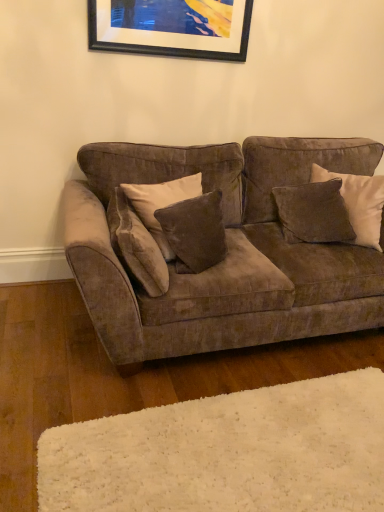
Locate an element on the screen. The width and height of the screenshot is (384, 512). white shag rug at lower center is located at coordinates (227, 452).

This screenshot has height=512, width=384. What do you see at coordinates (172, 28) in the screenshot?
I see `black matte picture frame at upper center` at bounding box center [172, 28].

Where is `velvet brown pillow at center, the first pillow in the left-to-right sequence`? velvet brown pillow at center, the first pillow in the left-to-right sequence is located at coordinates (136, 245).

In the scene shown: What is the approximate height of velvet brown pillow at center, the second pillow viewed from the left?

16.51 inches.

Where is `white shag rug at lower center`? white shag rug at lower center is located at coordinates (227, 452).

From the image's perspective, which one is positioned higher, black matte picture frame at upper center or velvet brown pillow at center, the first pillow in the left-to-right sequence?

black matte picture frame at upper center appears higher in the image.

Is black matte picture frame at upper center completely or partially outside of velvet brown pillow at center, the first pillow in the left-to-right sequence?

black matte picture frame at upper center is positioned outside velvet brown pillow at center, the first pillow in the left-to-right sequence.

Locate an element on the screen. Image resolution: width=384 pixels, height=512 pixels. pillow that is the 2nd one when counting forward from the black matte picture frame at upper center is located at coordinates (136, 245).

Is point (247, 39) closer to viewer compared to point (119, 230)?

No.

Can velvet brown pillow at right, which is the 3th pillow in left-to-right order, be found inside velvet brown pillow at center, the second pillow viewed from the left?

That's incorrect, velvet brown pillow at right, which is the 3th pillow in left-to-right order, is not inside velvet brown pillow at center, the second pillow viewed from the left.

Considering the sizes of velvet brown pillow at center, the second pillow viewed from the left, and velvet brown pillow at right, the second pillow viewed from the right, in the image, is velvet brown pillow at center, the second pillow viewed from the left, bigger or smaller than velvet brown pillow at right, the second pillow viewed from the right,?

Considering their sizes, velvet brown pillow at center, the second pillow viewed from the left, takes up more space than velvet brown pillow at right, the second pillow viewed from the right.

Does velvet brown pillow at center, the third pillow viewed from the right, have a greater height compared to velvet brown pillow at right, which is the 3th pillow in left-to-right order?

Indeed, velvet brown pillow at center, the third pillow viewed from the right, has a greater height compared to velvet brown pillow at right, which is the 3th pillow in left-to-right order.

From the image's perspective, is velvet brown pillow at center, the third pillow viewed from the right, under velvet brown pillow at right, which is the 3th pillow in left-to-right order?

Yes, from the image's perspective, velvet brown pillow at center, the third pillow viewed from the right, is below velvet brown pillow at right, which is the 3th pillow in left-to-right order.

Is velvet brown pillow at center, the 4th pillow in the right-to-left sequence, in contact with velvet brown pillow at right, which is the 3th pillow in left-to-right order?

No.

Is velvet brown pillow at center, the first pillow in the left-to-right sequence, to the left or to the right of velvet brown pillow at right, the second pillow viewed from the right, in the image?

velvet brown pillow at center, the first pillow in the left-to-right sequence, is to the left of velvet brown pillow at right, the second pillow viewed from the right.

Between velvet brown pillow at center, the first pillow in the left-to-right sequence, and velvet brown pillow at right, which is the 3th pillow in left-to-right order, which one has smaller width?

velvet brown pillow at center, the first pillow in the left-to-right sequence.

From a real-world perspective, is white shag rug at lower center positioned under velvet brown pillow at center, the 4th pillow in the right-to-left sequence, based on gravity?

Yes, from a real-world perspective, white shag rug at lower center is below velvet brown pillow at center, the 4th pillow in the right-to-left sequence.

Which pillow is the 2nd one when counting from the left side of the white shag rug at lower center? Please provide its 2D coordinates.

[(136, 245)]

Between white shag rug at lower center and velvet brown pillow at center, the first pillow in the left-to-right sequence, which one has larger size?

velvet brown pillow at center, the first pillow in the left-to-right sequence, is bigger.

Is velvet brown pillow at center, the second pillow viewed from the left, positioned before velvet brown couch at center?

No, the depth of velvet brown pillow at center, the second pillow viewed from the left, is greater than that of velvet brown couch at center.

Could you tell me if velvet brown pillow at center, the second pillow viewed from the left, is turned towards velvet brown couch at center?

Yes, velvet brown pillow at center, the second pillow viewed from the left, is turned towards velvet brown couch at center.

Choose the correct answer: Is velvet brown pillow at center, the third pillow viewed from the right, inside velvet brown couch at center or outside it?

velvet brown pillow at center, the third pillow viewed from the right, is spatially positioned inside velvet brown couch at center.

Is white shag rug at lower center oriented towards velvet brown pillow at right, which is the 3th pillow in left-to-right order?

No, white shag rug at lower center is not oriented towards velvet brown pillow at right, which is the 3th pillow in left-to-right order.

Is white shag rug at lower center not within velvet brown pillow at right, which is the 3th pillow in left-to-right order?

Yes, white shag rug at lower center is not within velvet brown pillow at right, which is the 3th pillow in left-to-right order.

Is white shag rug at lower center positioned before velvet brown pillow at right, which is the 3th pillow in left-to-right order?

Yes, white shag rug at lower center is closer to the camera.

Is white shag rug at lower center bigger than velvet brown pillow at right, which is the 3th pillow in left-to-right order?

Actually, white shag rug at lower center might be smaller than velvet brown pillow at right, which is the 3th pillow in left-to-right order.

From the image's perspective, which one is positioned higher, velvet brown couch at center or velvet brown pillow at center, the second pillow viewed from the left?

From the image's view, velvet brown pillow at center, the second pillow viewed from the left, is above.

In the scene shown: Between velvet brown couch at center and velvet brown pillow at center, the third pillow viewed from the right, which one has larger width?

velvet brown couch at center is wider.

Is velvet brown couch at center oriented towards velvet brown pillow at center, the second pillow viewed from the left?

Yes.

Is velvet brown couch at center positioned beyond the bounds of velvet brown pillow at center, the third pillow viewed from the right?

velvet brown couch at center is positioned outside velvet brown pillow at center, the third pillow viewed from the right.

Identify the location of picture frame behind the velvet brown pillow at center, the first pillow in the left-to-right sequence. This screenshot has height=512, width=384. (172, 28).

The width and height of the screenshot is (384, 512). Find the location of `the 1st pillow positioned below the velvet brown pillow at center, the second pillow viewed from the left (from a real-world perspective)`. the 1st pillow positioned below the velvet brown pillow at center, the second pillow viewed from the left (from a real-world perspective) is located at coordinates (313, 213).

Which object lies nearer to the anchor point black matte picture frame at upper center, velvet brown pillow at center, the 4th pillow in the right-to-left sequence, or white shag rug at lower center?

The object closer to black matte picture frame at upper center is velvet brown pillow at center, the 4th pillow in the right-to-left sequence.

Based on their spatial positions, is velvet brown pillow at right, which is the 3th pillow in left-to-right order, or velvet brown pillow at center, the first pillow in the left-to-right sequence, further from white shag rug at lower center?

Based on the image, velvet brown pillow at right, which is the 3th pillow in left-to-right order, appears to be further to white shag rug at lower center.

In the scene shown: Which object lies nearer to the anchor point velvet brown pillow at right, which is the 3th pillow in left-to-right order, velvet brown pillow at center, the second pillow viewed from the left, or white shag rug at lower center?

velvet brown pillow at center, the second pillow viewed from the left, is positioned closer to the anchor velvet brown pillow at right, which is the 3th pillow in left-to-right order.

Which object lies further to the anchor point velvet brown pillow at upper right, the 4th pillow from the left, velvet brown pillow at center, the 4th pillow in the right-to-left sequence, or white shag rug at lower center?

white shag rug at lower center is further to velvet brown pillow at upper right, the 4th pillow from the left.

From the image, which object appears to be farther from white shag rug at lower center, velvet brown pillow at right, which is the 3th pillow in left-to-right order, or velvet brown couch at center?

velvet brown pillow at right, which is the 3th pillow in left-to-right order, is positioned further to the anchor white shag rug at lower center.

From the image, which object appears to be farther from velvet brown couch at center, velvet brown pillow at upper right, the 4th pillow from the left, or velvet brown pillow at right, which is the 3th pillow in left-to-right order?

velvet brown pillow at upper right, the 4th pillow from the left.

Estimate the real-world distances between objects in this image. Which object is closer to white shag rug at lower center, velvet brown pillow at center, the second pillow viewed from the left, or velvet brown pillow at center, the 4th pillow in the right-to-left sequence?

velvet brown pillow at center, the 4th pillow in the right-to-left sequence, is positioned closer to the anchor white shag rug at lower center.

Looking at this image, estimate the real-world distances between objects in this image. Which object is closer to velvet brown pillow at center, the first pillow in the left-to-right sequence, black matte picture frame at upper center or velvet brown pillow at right, which is the 3th pillow in left-to-right order?

velvet brown pillow at right, which is the 3th pillow in left-to-right order, lies closer to velvet brown pillow at center, the first pillow in the left-to-right sequence, than the other object.

At what (x,y) coordinates should I click in order to perform the action: click on studio couch between black matte picture frame at upper center and velvet brown pillow at center, the 4th pillow in the right-to-left sequence, in the up-down direction. Please return your answer as a coordinate pair (x, y). This screenshot has height=512, width=384. Looking at the image, I should click on pos(227,254).

You are a GUI agent. You are given a task and a screenshot of the screen. Output one action in this format:
    pyautogui.click(x=<x>, y=<y>)
    Task: Click on the studio couch between velvet brown pillow at center, the third pillow viewed from the right, and white shag rug at lower center vertically
    
    Given the screenshot: What is the action you would take?
    (x=227, y=254)

Where is `studio couch between velvet brown pillow at center, the second pillow viewed from the left, and velvet brown pillow at upper right, which appears as the 1th pillow when viewed from the right`? studio couch between velvet brown pillow at center, the second pillow viewed from the left, and velvet brown pillow at upper right, which appears as the 1th pillow when viewed from the right is located at coordinates (227, 254).

In order to click on pillow between velvet brown pillow at center, the second pillow viewed from the left, and velvet brown pillow at upper right, which appears as the 1th pillow when viewed from the right in this screenshot , I will do `click(313, 213)`.